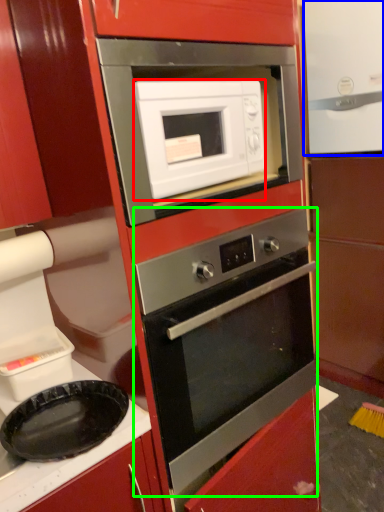
Question: Considering the real-world distances, which object is farthest from microwave oven (highlighted by a red box)? appliance (highlighted by a blue box) or oven (highlighted by a green box)?

Choices:
 (A) appliance
 (B) oven

Answer: (A)